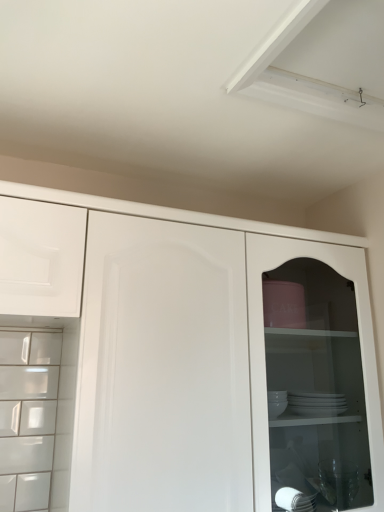
Question: Should I look upward or downward to see white matte drawer at upper left?

Choices:
 (A) down
 (B) up

Answer: (A)

Question: Can you confirm if white glossy cupboard at center is taller than white matte drawer at upper left?

Choices:
 (A) yes
 (B) no

Answer: (A)

Question: Is white glossy cupboard at center wider than white matte drawer at upper left?

Choices:
 (A) yes
 (B) no

Answer: (A)

Question: Considering the relative positions of white glossy cupboard at center and white matte drawer at upper left in the image provided, is white glossy cupboard at center to the left of white matte drawer at upper left from the viewer's perspective?

Choices:
 (A) no
 (B) yes

Answer: (A)

Question: Is white matte drawer at upper left located within white glossy cupboard at center?

Choices:
 (A) no
 (B) yes

Answer: (A)

Question: Can you confirm if white glossy cupboard at center is bigger than white matte drawer at upper left?

Choices:
 (A) yes
 (B) no

Answer: (A)

Question: Is white glossy cupboard at center to the right of white matte drawer at upper left from the viewer's perspective?

Choices:
 (A) yes
 (B) no

Answer: (A)

Question: Does white matte drawer at upper left turn towards white glossy cupboard at center?

Choices:
 (A) yes
 (B) no

Answer: (B)

Question: Can you confirm if white matte drawer at upper left is shorter than white glossy cupboard at center?

Choices:
 (A) no
 (B) yes

Answer: (B)

Question: Is white matte drawer at upper left further to camera compared to white glossy cupboard at center?

Choices:
 (A) yes
 (B) no

Answer: (A)

Question: Is the depth of white matte drawer at upper left less than that of white glossy cupboard at center?

Choices:
 (A) no
 (B) yes

Answer: (A)

Question: Considering the relative sizes of white matte drawer at upper left and white glossy cupboard at center in the image provided, is white matte drawer at upper left wider than white glossy cupboard at center?

Choices:
 (A) no
 (B) yes

Answer: (A)

Question: Does white matte drawer at upper left appear on the right side of white glossy cupboard at center?

Choices:
 (A) no
 (B) yes

Answer: (A)

Question: From a real-world perspective, is white glossy cupboard at center positioned above or below white matte drawer at upper left?

Choices:
 (A) below
 (B) above

Answer: (A)